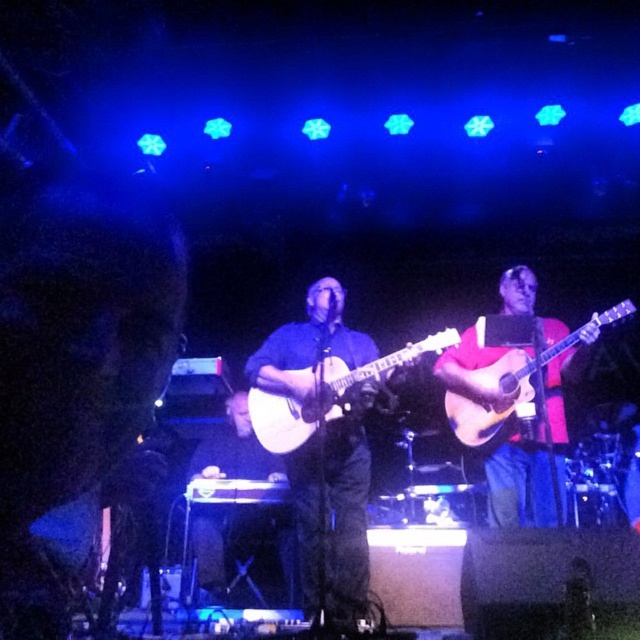
You are a photographer backstage who needs to capture a closeup shot of the wooden acoustic guitar at center and the light brown acoustic guitar at center. Which guitar should you focus on to ensure it appears larger in the photo?

The wooden acoustic guitar at center is closer to the viewer, so focusing on it will make it appear larger in the photo compared to the light brown acoustic guitar at center.

You are a stagehand who needs to place a 5 feet long ladder between the matte wood guitar at center and the white matte acoustic guitar at center. Can the ladder fit between them without overlapping the guitars?

The distance between the matte wood guitar at center and the white matte acoustic guitar at center is 4.69 feet. Since the ladder is 5 feet long, it cannot fit between them without overlapping the guitars.